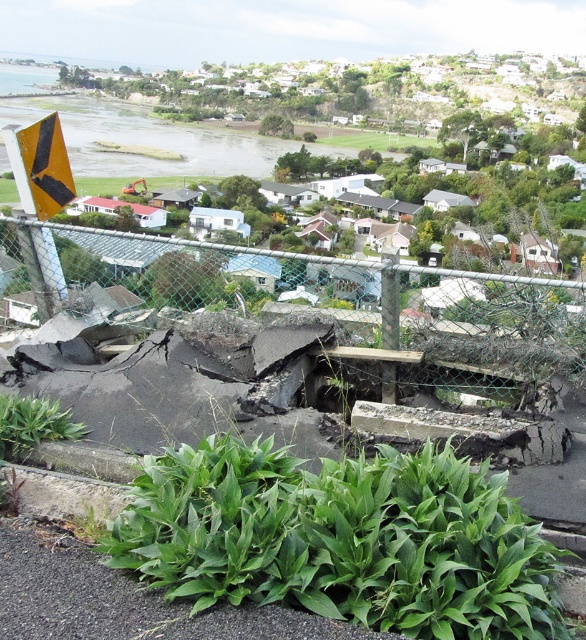
You are a safety inspector assessing the scene. You notice the wire mesh fence at center and the yellow matte triangle at upper left. Which object takes up more space in the image?

The yellow matte triangle at upper left is larger than the wire mesh fence at center, so it takes up more space in the image.

You are a landscape architect assessing the area. You notice the green leafy plant at lower center and the wire mesh fence at center. Which object occupies more space in the scene?

The green leafy plant at lower center has a larger size compared to the wire mesh fence at center, so it occupies more space in the scene.